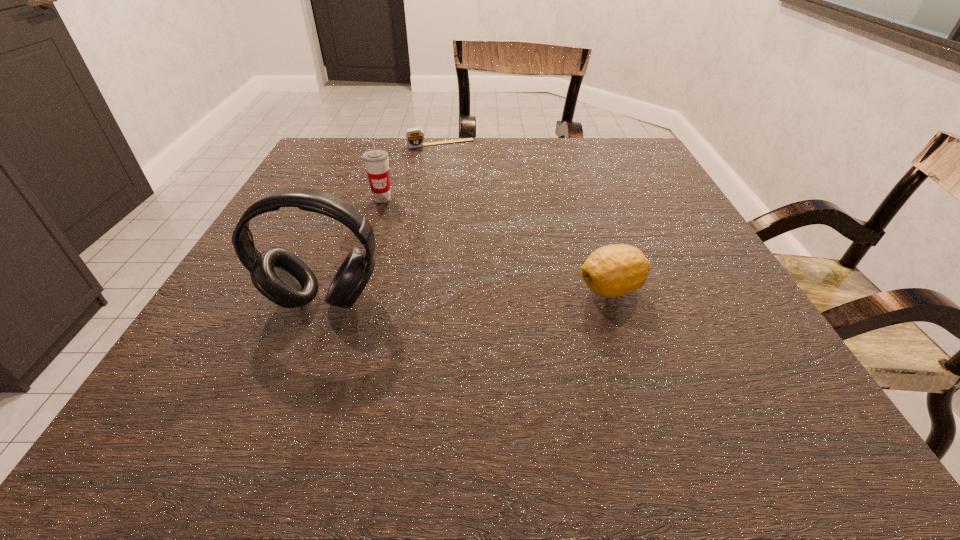
Locate an element on the screen. headset is located at coordinates (279, 275).

This screenshot has height=540, width=960. What are the coordinates of `lemon` in the screenshot? It's located at (614, 270).

The width and height of the screenshot is (960, 540). In order to click on the third tallest object in this screenshot , I will do `click(614, 270)`.

This screenshot has height=540, width=960. What are the coordinates of `cup` in the screenshot? It's located at (376, 162).

Identify the location of the third nearest object. (376, 162).

You are a GUI agent. You are given a task and a screenshot of the screen. Output one action in this format:
    pyautogui.click(x=<x>, y=<y>)
    Task: Click on the tape measure
    The height and width of the screenshot is (540, 960).
    Given the screenshot: What is the action you would take?
    pyautogui.click(x=414, y=137)

Where is `the shortest object`? This screenshot has height=540, width=960. the shortest object is located at coordinates (414, 137).

Image resolution: width=960 pixels, height=540 pixels. Identify the location of free space located on the earcups of the tallest object. (300, 363).

In order to click on free space located at the stem end of the rightmost object in this screenshot , I will do (x=406, y=289).

Locate an element on the screen. This screenshot has width=960, height=540. vacant region located at the stem end of the rightmost object is located at coordinates (400, 289).